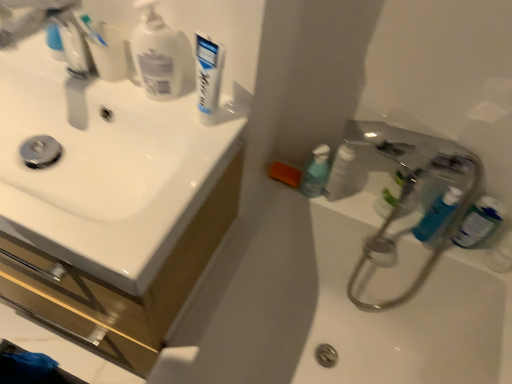
Identify the location of vacant space positioned to the left of white matte pump bottle at upper left. The width and height of the screenshot is (512, 384). (76, 82).